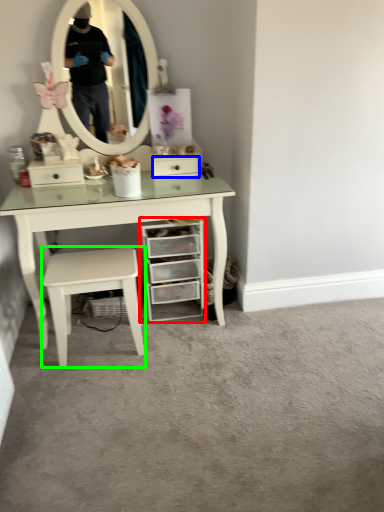
Question: Based on their relative distances, which object is nearer to chest of drawers (highlighted by a red box)? Choose from drawer (highlighted by a blue box) and stool (highlighted by a green box).

Choices:
 (A) drawer
 (B) stool

Answer: (B)